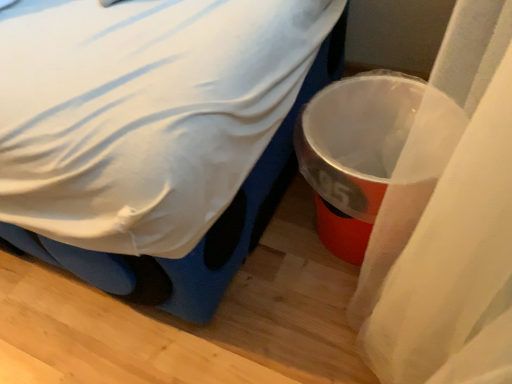
Describe the element at coordinates (156, 132) in the screenshot. I see `white fabric bed at center` at that location.

I want to click on white fabric bed at center, so click(x=156, y=132).

Where is `metallic plastic trash can at right`? This screenshot has height=384, width=512. metallic plastic trash can at right is located at coordinates (354, 152).

The width and height of the screenshot is (512, 384). What do you see at coordinates (354, 152) in the screenshot?
I see `metallic plastic trash can at right` at bounding box center [354, 152].

This screenshot has width=512, height=384. Find the location of `white fabric bed at center`. white fabric bed at center is located at coordinates (156, 132).

Is metallic plastic trash can at right to the left or to the right of white fabric bed at center in the image?

metallic plastic trash can at right is positioned on white fabric bed at center's right side.

Is metallic plastic trash can at right positioned before white fabric bed at center?

No, the depth of metallic plastic trash can at right is greater than that of white fabric bed at center.

Does point (392, 166) appear closer or farther from the camera than point (157, 193)?

Point (392, 166).

From the image's perspective, is metallic plastic trash can at right located beneath white fabric bed at center?

Correct, metallic plastic trash can at right appears lower than white fabric bed at center in the image.

From a real-world perspective, is metallic plastic trash can at right physically below white fabric bed at center?

Yes, from a real-world perspective, metallic plastic trash can at right is beneath white fabric bed at center.

Between metallic plastic trash can at right and white fabric bed at center, which one has larger width?

With larger width is white fabric bed at center.

Between metallic plastic trash can at right and white fabric bed at center, which one has less height?

With less height is metallic plastic trash can at right.

Between metallic plastic trash can at right and white fabric bed at center, which one has larger size?

Bigger between the two is white fabric bed at center.

From the picture: Is metallic plastic trash can at right located outside white fabric bed at center?

metallic plastic trash can at right is positioned outside white fabric bed at center.

Is metallic plastic trash can at right next to white fabric bed at center?

No, metallic plastic trash can at right is not in contact with white fabric bed at center.

Does metallic plastic trash can at right turn towards white fabric bed at center?

No, metallic plastic trash can at right is not oriented towards white fabric bed at center.

How different are the orientations of metallic plastic trash can at right and white fabric bed at center in degrees?

5.34 degrees.

How much distance is there between metallic plastic trash can at right and white fabric bed at center?

metallic plastic trash can at right is 7.63 inches from white fabric bed at center.

You are a GUI agent. You are given a task and a screenshot of the screen. Output one action in this format:
    pyautogui.click(x=<x>, y=<y>)
    Task: Click on the bed lying in front of the metallic plastic trash can at right
    The width and height of the screenshot is (512, 384).
    Given the screenshot: What is the action you would take?
    pyautogui.click(x=156, y=132)

Considering the relative positions of white fabric bed at center and metallic plastic trash can at right in the image provided, is white fabric bed at center to the left of metallic plastic trash can at right from the viewer's perspective?

Correct, you'll find white fabric bed at center to the left of metallic plastic trash can at right.

Is the depth of white fabric bed at center less than that of metallic plastic trash can at right?

Yes.

Is point (321, 44) less distant than point (403, 127)?

No, it is not.

From the image's perspective, is white fabric bed at center above or below metallic plastic trash can at right?

Clearly, from the image's perspective, white fabric bed at center is above metallic plastic trash can at right.

From a real-world perspective, is white fabric bed at center located higher than metallic plastic trash can at right?

Yes, from a real-world perspective, white fabric bed at center is over metallic plastic trash can at right

Between white fabric bed at center and metallic plastic trash can at right, which one has larger width?

white fabric bed at center.

Considering the sizes of objects white fabric bed at center and metallic plastic trash can at right in the image provided, who is shorter, white fabric bed at center or metallic plastic trash can at right?

metallic plastic trash can at right is shorter.

Can you confirm if white fabric bed at center is smaller than metallic plastic trash can at right?

Actually, white fabric bed at center might be larger than metallic plastic trash can at right.

Is metallic plastic trash can at right surrounded by white fabric bed at center?

No, metallic plastic trash can at right is not surrounded by white fabric bed at center.

Is white fabric bed at center directly adjacent to metallic plastic trash can at right?

There is a gap between white fabric bed at center and metallic plastic trash can at right.

Does white fabric bed at center turn towards metallic plastic trash can at right?

No.

Can you tell me how much white fabric bed at center and metallic plastic trash can at right differ in facing direction?

5.34 degrees separate the facing orientations of white fabric bed at center and metallic plastic trash can at right.

Where is `bed on the left of the metallic plastic trash can at right`? The height and width of the screenshot is (384, 512). bed on the left of the metallic plastic trash can at right is located at coordinates (156, 132).

This screenshot has height=384, width=512. Find the location of `bed lying above the metallic plastic trash can at right (from the image's perspective)`. bed lying above the metallic plastic trash can at right (from the image's perspective) is located at coordinates (156, 132).

Locate an element on the screen. This screenshot has height=384, width=512. waste container behind the white fabric bed at center is located at coordinates (354, 152).